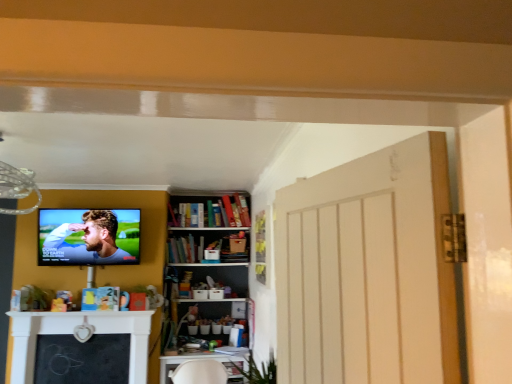
Question: From the image's perspective, is hardcover books at center on matte black tv at upper left?

Choices:
 (A) no
 (B) yes

Answer: (A)

Question: Is hardcover books at center positioned with its back to matte black tv at upper left?

Choices:
 (A) no
 (B) yes

Answer: (A)

Question: Considering the relative sizes of hardcover books at center and matte black tv at upper left in the image provided, is hardcover books at center thinner than matte black tv at upper left?

Choices:
 (A) no
 (B) yes

Answer: (A)

Question: Can you confirm if hardcover books at center is shorter than matte black tv at upper left?

Choices:
 (A) no
 (B) yes

Answer: (B)

Question: Does hardcover books at center have a smaller size compared to matte black tv at upper left?

Choices:
 (A) no
 (B) yes

Answer: (B)

Question: Is hardcover books at center inside the boundaries of white plastic table at lower center, or outside?

Choices:
 (A) inside
 (B) outside

Answer: (B)

Question: Is hardcover books at center wider or thinner than white plastic table at lower center?

Choices:
 (A) thin
 (B) wide

Answer: (A)

Question: In terms of height, does hardcover books at center look taller or shorter compared to white plastic table at lower center?

Choices:
 (A) tall
 (B) short

Answer: (B)

Question: In terms of size, does hardcover books at center appear bigger or smaller than white plastic table at lower center?

Choices:
 (A) small
 (B) big

Answer: (A)

Question: From their relative heights in the image, would you say white plastic table at lower center is taller or shorter than matte black tv at upper left?

Choices:
 (A) tall
 (B) short

Answer: (B)

Question: Is white plastic table at lower center to the left or to the right of matte black tv at upper left in the image?

Choices:
 (A) left
 (B) right

Answer: (B)

Question: Which is correct: white plastic table at lower center is inside matte black tv at upper left, or outside of it?

Choices:
 (A) outside
 (B) inside

Answer: (A)

Question: From a real-world perspective, is white plastic table at lower center positioned above or below matte black tv at upper left?

Choices:
 (A) below
 (B) above

Answer: (A)

Question: Considering the relative positions of matte black tv at upper left and white plastic table at lower center in the image provided, is matte black tv at upper left to the left or to the right of white plastic table at lower center?

Choices:
 (A) right
 (B) left

Answer: (B)

Question: Is matte black tv at upper left taller or shorter than white plastic table at lower center?

Choices:
 (A) short
 (B) tall

Answer: (B)